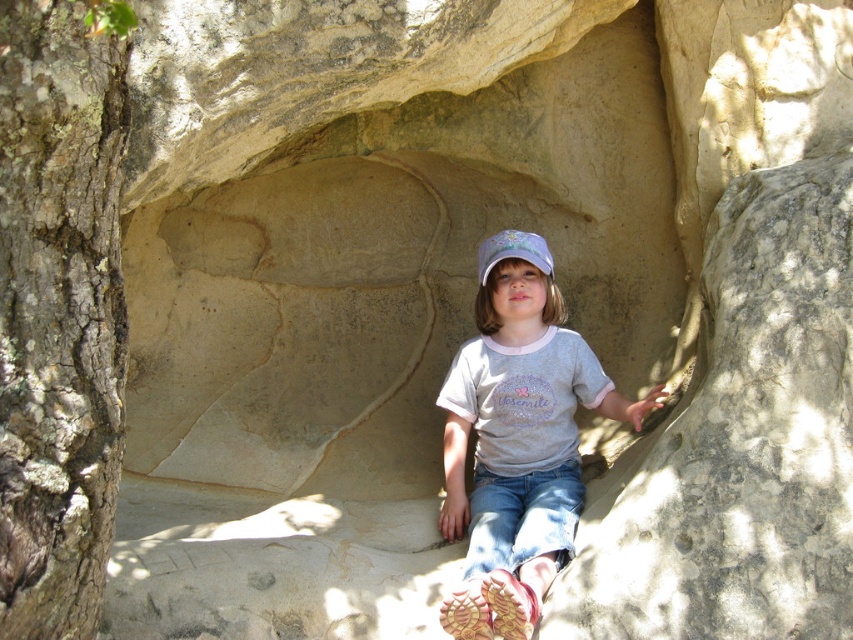
Question: Which is farther from the white cotton cap at center?

Choices:
 (A) brown rough bark tree at left
 (B) matte gray shirt at center

Answer: (A)

Question: Considering the real-world distances, which object is farthest from the matte gray shirt at center?

Choices:
 (A) white cotton cap at center
 (B) brown rough bark tree at left

Answer: (B)

Question: Is matte gray shirt at center smaller than white cotton cap at center?

Choices:
 (A) no
 (B) yes

Answer: (A)

Question: Is brown rough bark tree at left positioned behind matte gray shirt at center?

Choices:
 (A) yes
 (B) no

Answer: (B)

Question: Observing the image, what is the correct spatial positioning of brown rough bark tree at left in reference to white cotton cap at center?

Choices:
 (A) above
 (B) below

Answer: (B)

Question: Which object appears farthest from the camera in this image?

Choices:
 (A) matte gray shirt at center
 (B) brown rough bark tree at left
 (C) white cotton cap at center

Answer: (C)